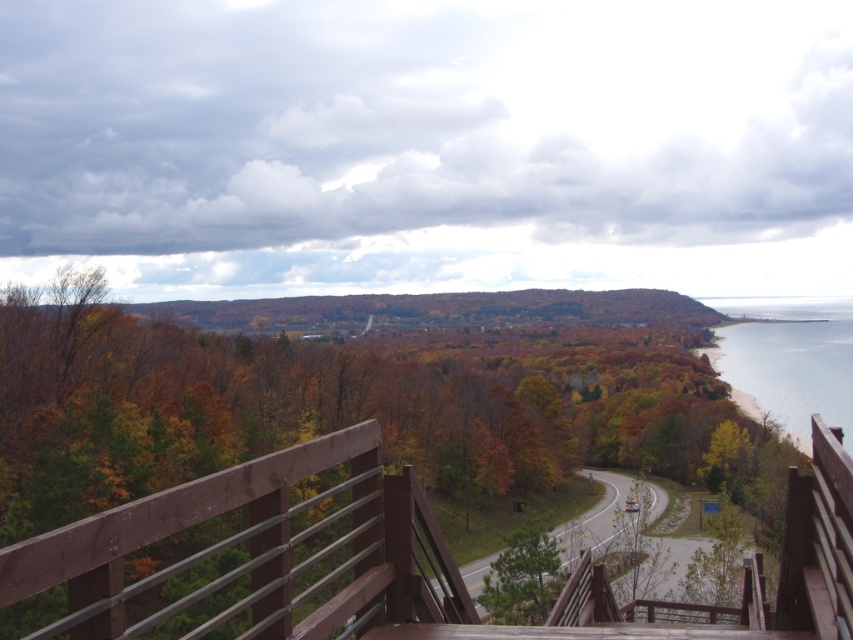
You are standing at the point labeled as point (405,557) in the image. Based on the scene description, what structure are you most likely standing on?

The point (405,557) corresponds to the brown wooden deck at center, so you are most likely standing on the brown wooden deck at center.

You are standing on the brown wooden deck at center and want to see the clear blue water at lower right. Which direction should you look to see it?

The clear blue water at lower right is lower than the brown wooden deck at center, so you should look downward to see it.

You are standing on the wooden observation deck and want to look at two points in the scene. Which of the two points, point (x=711, y=621) or point (x=839, y=301), is closer to you?

Point (x=711, y=621) is closer to the viewer than point (x=839, y=301).